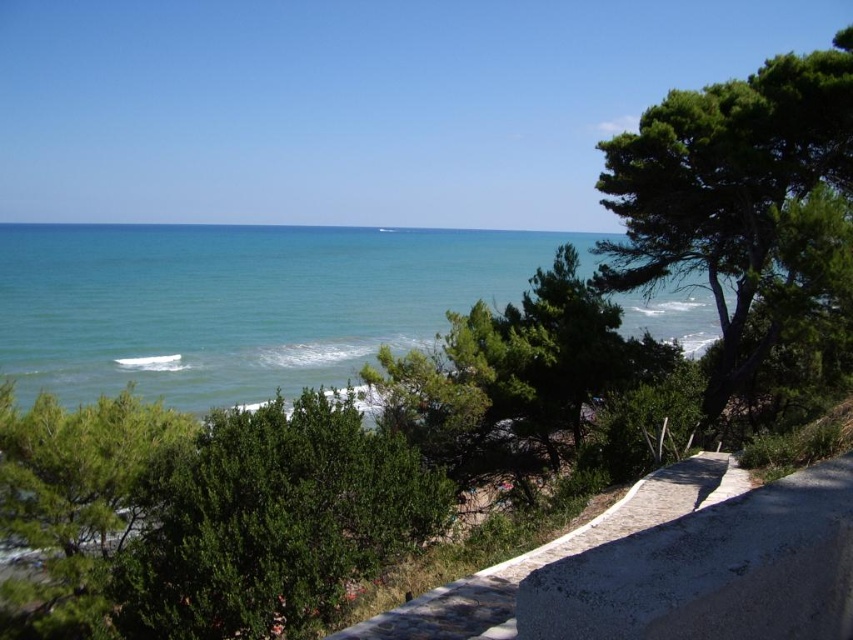
Question: Can you confirm if blue water at center is bigger than green textured tree at right?

Choices:
 (A) yes
 (B) no

Answer: (A)

Question: Considering the real-world distances, which object is farthest from the blue water at center?

Choices:
 (A) green textured tree at right
 (B) green leafy bush at center

Answer: (B)

Question: Can you confirm if blue water at center is positioned to the right of green textured tree at right?

Choices:
 (A) no
 (B) yes

Answer: (A)

Question: Which object is closer to the camera taking this photo?

Choices:
 (A) blue water at center
 (B) green textured tree at right

Answer: (B)

Question: Which point is closer to the camera?

Choices:
 (A) (724, 84)
 (B) (310, 445)

Answer: (B)

Question: Observing the image, what is the correct spatial positioning of green leafy bush at center in reference to green textured tree at right?

Choices:
 (A) below
 (B) above

Answer: (A)